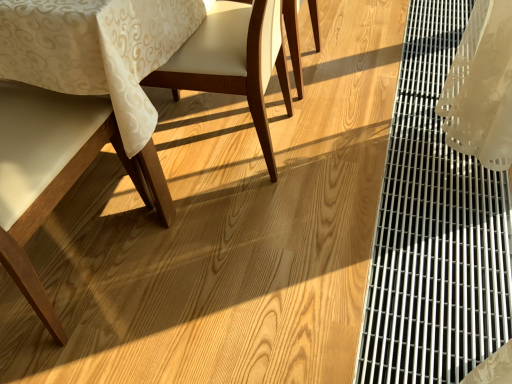
The width and height of the screenshot is (512, 384). Describe the element at coordinates (293, 40) in the screenshot. I see `wooden chair at center, positioned as the first chair in right-to-left order` at that location.

The height and width of the screenshot is (384, 512). I want to click on matte wood chair at center, which appears as the 3th chair when viewed from the left, so 233,63.

I want to click on metallic grid at right, so click(x=434, y=230).

In order to face matte white chair at left, which appears as the fourth chair when viewed from the right, should I rotate leftwards or rightwards?

Rotate your view left by about 31.098°.

The height and width of the screenshot is (384, 512). Find the location of `wooden chair at center, acting as the 4th chair starting from the left`. wooden chair at center, acting as the 4th chair starting from the left is located at coordinates (293, 40).

Is wooden chair at center, acting as the 4th chair starting from the left, positioned beyond the bounds of matte wood chair at left, the third chair positioned from the right?

Yes.

From their relative heights in the image, would you say wooden chair at center, positioned as the first chair in right-to-left order, is taller or shorter than matte wood chair at left, the third chair positioned from the right?

Clearly, wooden chair at center, positioned as the first chair in right-to-left order, is shorter compared to matte wood chair at left, the third chair positioned from the right.

I want to click on the 2nd chair to the left of the wooden chair at center, acting as the 4th chair starting from the left, counting from the anchor's position, so click(x=97, y=50).

Is wooden chair at center, positioned as the first chair in right-to-left order, thinner than matte wood chair at left, acting as the 2th chair starting from the left?

Yes.

Is matte white chair at left, which appears as the fourth chair when viewed from the right, in contact with metallic grid at right?

There is a gap between matte white chair at left, which appears as the fourth chair when viewed from the right, and metallic grid at right.

Which is nearer, [18,254] or [386,251]?

The point [18,254] is more forward.

Which object is closer to the camera, matte white chair at left, which appears as the fourth chair when viewed from the right, or metallic grid at right?

matte white chair at left, which appears as the fourth chair when viewed from the right.

How different are the orientations of matte white chair at left, which appears as the fourth chair when viewed from the right, and metallic grid at right in degrees?

matte white chair at left, which appears as the fourth chair when viewed from the right, and metallic grid at right are facing 91 degrees away from each other.

From the image's perspective, which one is positioned higher, matte wood chair at center, the second chair when ordered from right to left, or wooden chair at center, positioned as the first chair in right-to-left order?

wooden chair at center, positioned as the first chair in right-to-left order, from the image's perspective.

Which object is further away from the camera taking this photo, matte wood chair at center, which appears as the 3th chair when viewed from the left, or wooden chair at center, positioned as the first chair in right-to-left order?

wooden chair at center, positioned as the first chair in right-to-left order, is more distant.

Is matte wood chair at center, which appears as the 3th chair when viewed from the left, taller or shorter than wooden chair at center, positioned as the first chair in right-to-left order?

Clearly, matte wood chair at center, which appears as the 3th chair when viewed from the left, is taller compared to wooden chair at center, positioned as the first chair in right-to-left order.

Considering the sizes of matte white chair at left, which appears as the fourth chair when viewed from the right, and matte wood chair at center, the second chair when ordered from right to left, in the image, is matte white chair at left, which appears as the fourth chair when viewed from the right, wider or thinner than matte wood chair at center, the second chair when ordered from right to left,?

In the image, matte white chair at left, which appears as the fourth chair when viewed from the right, appears to be wider than matte wood chair at center, the second chair when ordered from right to left.

Consider the image. From a real-world perspective, is matte white chair at left, which appears as the fourth chair when viewed from the right, positioned above or below matte wood chair at center, which appears as the 3th chair when viewed from the left?

Clearly, from a real-world perspective, matte white chair at left, which appears as the fourth chair when viewed from the right, is above matte wood chair at center, which appears as the 3th chair when viewed from the left.

Looking at this image, is matte wood chair at center, which appears as the 3th chair when viewed from the left, a part of matte white chair at left, which ranks as the first chair in left-to-right order?

That's incorrect, matte wood chair at center, which appears as the 3th chair when viewed from the left, is not inside matte white chair at left, which ranks as the first chair in left-to-right order.

Which object is further away from the camera, matte wood chair at center, which appears as the 3th chair when viewed from the left, or matte white chair at left, which ranks as the first chair in left-to-right order?

matte wood chair at center, which appears as the 3th chair when viewed from the left, is further from the camera.

From the image's perspective, which is above, matte wood chair at center, the second chair when ordered from right to left, or matte white chair at left, which appears as the fourth chair when viewed from the right?

matte wood chair at center, the second chair when ordered from right to left.

Looking at this image, is matte wood chair at center, which appears as the 3th chair when viewed from the left, spatially inside matte white chair at left, which appears as the fourth chair when viewed from the right, or outside of it?

matte wood chair at center, which appears as the 3th chair when viewed from the left, is outside matte white chair at left, which appears as the fourth chair when viewed from the right.

Is matte white chair at left, which ranks as the first chair in left-to-right order, closer to camera compared to matte wood chair at left, acting as the 2th chair starting from the left?

Yes, it is.

Where is `chair that is above the matte wood chair at left, the third chair positioned from the right (from a real-world perspective)`? Image resolution: width=512 pixels, height=384 pixels. chair that is above the matte wood chair at left, the third chair positioned from the right (from a real-world perspective) is located at coordinates (58, 172).

Considering the relative sizes of matte white chair at left, which appears as the fourth chair when viewed from the right, and matte wood chair at left, acting as the 2th chair starting from the left, in the image provided, is matte white chair at left, which appears as the fourth chair when viewed from the right, smaller than matte wood chair at left, acting as the 2th chair starting from the left,?

Indeed, matte white chair at left, which appears as the fourth chair when viewed from the right, has a smaller size compared to matte wood chair at left, acting as the 2th chair starting from the left.

From the image's perspective, who appears lower, wooden chair at center, positioned as the first chair in right-to-left order, or matte wood chair at center, which appears as the 3th chair when viewed from the left?

matte wood chair at center, which appears as the 3th chair when viewed from the left, from the image's perspective.

Is wooden chair at center, positioned as the first chair in right-to-left order, not inside matte wood chair at center, the second chair when ordered from right to left?

Indeed, wooden chair at center, positioned as the first chair in right-to-left order, is completely outside matte wood chair at center, the second chair when ordered from right to left.

What's the angular difference between wooden chair at center, positioned as the first chair in right-to-left order, and matte wood chair at center, which appears as the 3th chair when viewed from the left,'s facing directions?

They differ by 1.13 degrees in their facing directions.

Is wooden chair at center, acting as the 4th chair starting from the left, closer to camera compared to matte wood chair at center, which appears as the 3th chair when viewed from the left?

No, wooden chair at center, acting as the 4th chair starting from the left, is further to the viewer.

This screenshot has width=512, height=384. Identify the location of chair that is the 2nd object to the left of the wooden chair at center, positioned as the first chair in right-to-left order, starting at the anchor. (97, 50).

From a real-world perspective, count 4th chairs upward from the metallic grid at right and point to it. Please provide its 2D coordinates.

[(58, 172)]

When comparing their distances from metallic grid at right, does wooden chair at center, positioned as the first chair in right-to-left order, or matte wood chair at center, the second chair when ordered from right to left, seem closer?

matte wood chair at center, the second chair when ordered from right to left, is closer to metallic grid at right.

Based on their spatial positions, is metallic grid at right or matte wood chair at left, the third chair positioned from the right, closer to wooden chair at center, acting as the 4th chair starting from the left?

metallic grid at right is closer to wooden chair at center, acting as the 4th chair starting from the left.

Considering their positions, is matte white chair at left, which appears as the fourth chair when viewed from the right, positioned further to wooden chair at center, acting as the 4th chair starting from the left, than matte wood chair at center, the second chair when ordered from right to left?

matte white chair at left, which appears as the fourth chair when viewed from the right, is positioned further to the anchor wooden chair at center, acting as the 4th chair starting from the left.

Which object lies further to the anchor point matte wood chair at center, which appears as the 3th chair when viewed from the left, matte wood chair at left, the third chair positioned from the right, or matte white chair at left, which appears as the fourth chair when viewed from the right?

matte white chair at left, which appears as the fourth chair when viewed from the right.

From the image, which object appears to be farther from wooden chair at center, positioned as the first chair in right-to-left order, matte wood chair at center, the second chair when ordered from right to left, or matte wood chair at left, acting as the 2th chair starting from the left?

matte wood chair at left, acting as the 2th chair starting from the left, is positioned further to the anchor wooden chair at center, positioned as the first chair in right-to-left order.

Which object lies nearer to the anchor point metallic grid at right, matte wood chair at left, acting as the 2th chair starting from the left, or matte wood chair at center, the second chair when ordered from right to left?

matte wood chair at center, the second chair when ordered from right to left, is closer to metallic grid at right.

Based on their spatial positions, is matte wood chair at left, the third chair positioned from the right, or metallic grid at right closer to matte white chair at left, which appears as the fourth chair when viewed from the right?

matte wood chair at left, the third chair positioned from the right, is closer to matte white chair at left, which appears as the fourth chair when viewed from the right.

Looking at the image, which one is located closer to metallic grid at right, matte white chair at left, which appears as the fourth chair when viewed from the right, or wooden chair at center, positioned as the first chair in right-to-left order?

wooden chair at center, positioned as the first chair in right-to-left order, is closer to metallic grid at right.

I want to click on chair between matte white chair at left, which appears as the fourth chair when viewed from the right, and matte wood chair at center, which appears as the 3th chair when viewed from the left, from left to right, so click(97, 50).

Locate an element on the screen. chair between matte wood chair at center, the second chair when ordered from right to left, and metallic grid at right from left to right is located at coordinates (293, 40).

Find the location of a particular element. chair between matte wood chair at left, acting as the 2th chair starting from the left, and wooden chair at center, positioned as the first chair in right-to-left order is located at coordinates (233, 63).